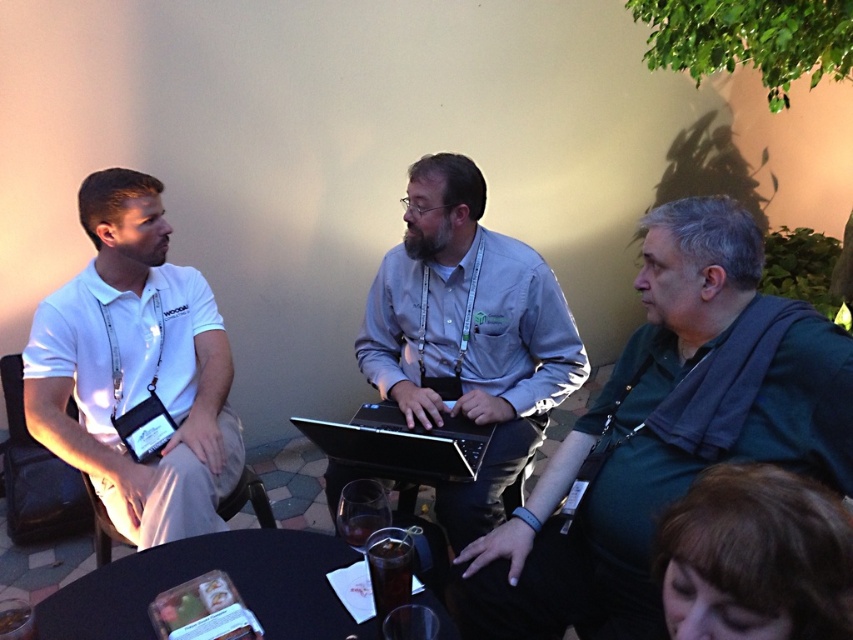
You are standing in front of the black plastic table at lower center and want to hand a document to the person wearing the white matte polo shirt at left. Can you reach them without moving from your current position?

The white matte polo shirt at left is further to the viewer than the black plastic table at lower center, so you can reach them without moving from your current position since they are closer to you.

You are a photographer at this event and need to capture a clear shot of both the dark green shirt at center and the black matte laptop at center. Considering their heights, which one might require you to adjust your camera angle more?

The dark green shirt at center is much taller than the black matte laptop at center, so you would need to adjust your camera angle more to capture the dark green shirt at center properly.